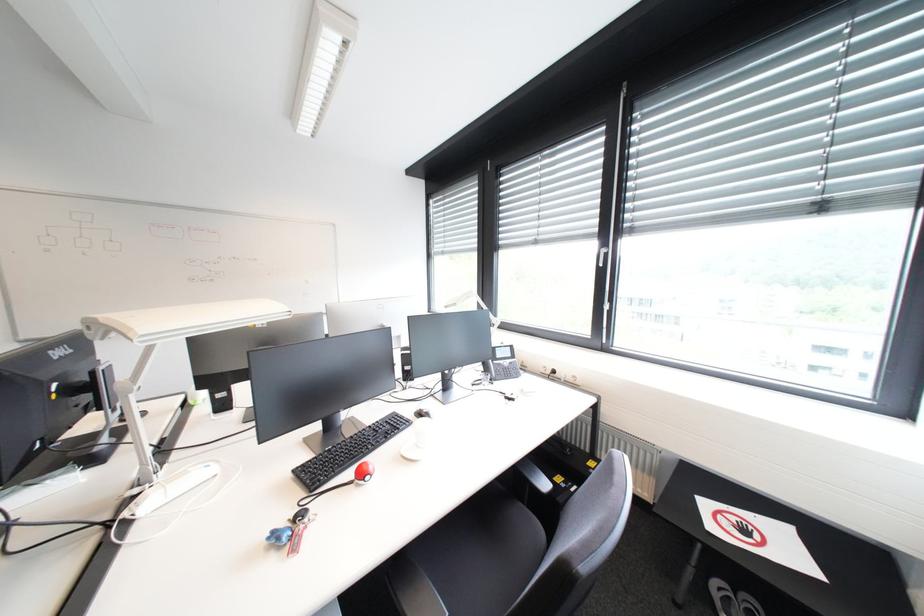
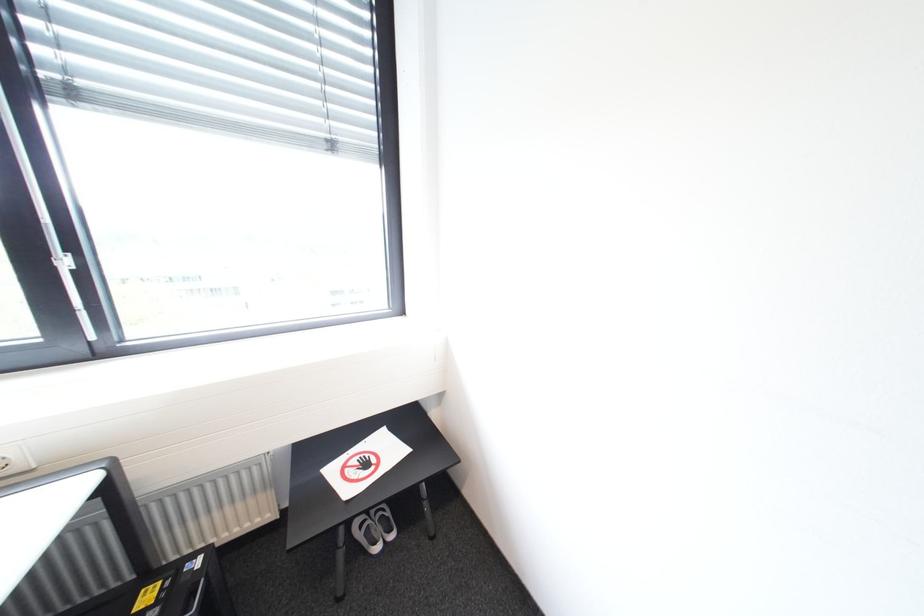
Question: The first image is from the beginning of the video and the second image is from the end. How did the camera likely rotate when shooting the video?

Choices:
 (A) Left
 (B) Right
 (C) Up
 (D) Down

Answer: (B)